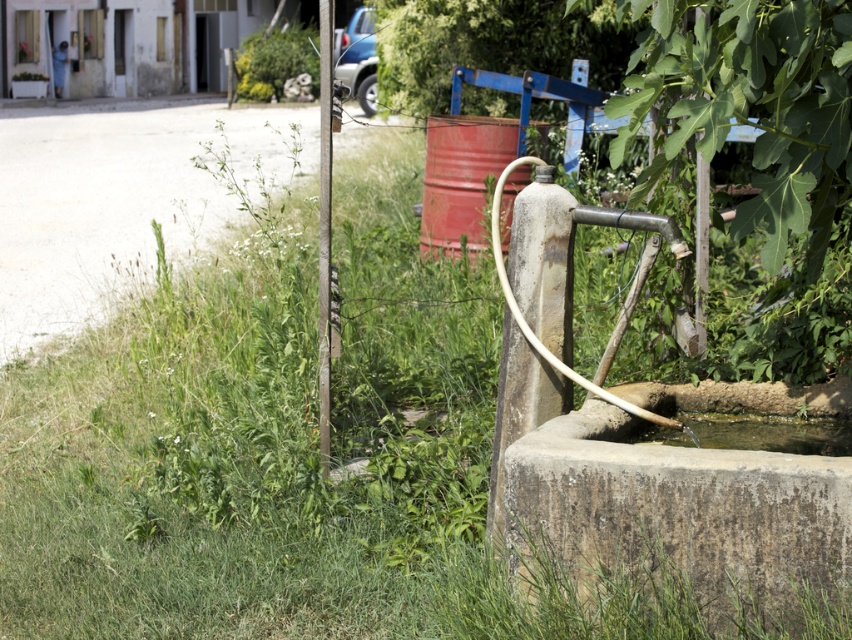
You are standing in front of the water fountain and notice two points marked in the scene. The first point is at coordinates point (810,394) and the second is at point (671,442). Which point is closer to you?

Point (671,442) is closer to you because it is less further to the camera than point (810,394).

You are standing at the center of the gravel road leading to the building. You want to water the plants near the white building using the hose attached to the gray concrete fountain at lower right. However, you notice the hose is coiled and only reaches up to point (678, 518). Can you determine if the hose will reach the gray concrete fountain at lower right from your current position?

The gray concrete fountain at lower right is located at point (678, 518), so the hose reaches exactly to that point. Therefore, you can water the plants near the white building by extending the hose fully to the gray concrete fountain at lower right.